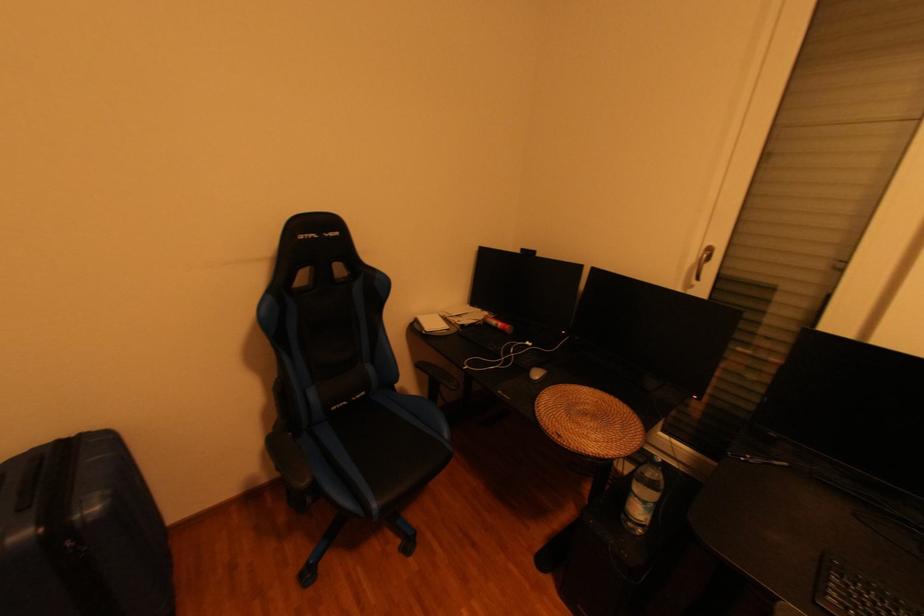
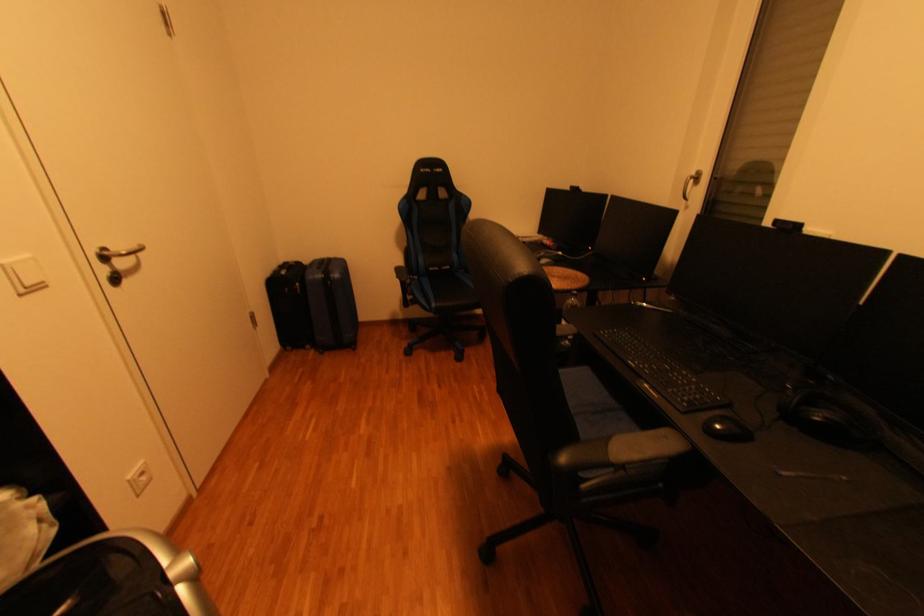
The images are taken continuously from a first-person perspective. In which direction are you moving?

The cameraman moved toward right, backward.